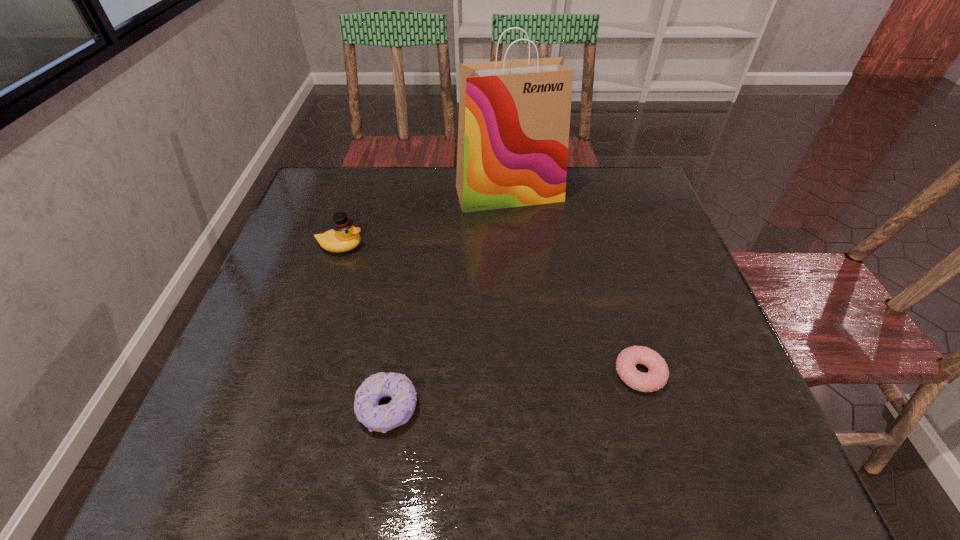
You are a GUI agent. You are given a task and a screenshot of the screen. Output one action in this format:
    pyautogui.click(x=<x>, y=<y>)
    Task: Click on the free space that satisfies the following two spatial constraints: 1. on the back side of the taller doughnut; 2. on the left side of the shorter doughnut
    The height and width of the screenshot is (540, 960).
    Given the screenshot: What is the action you would take?
    pyautogui.click(x=394, y=374)